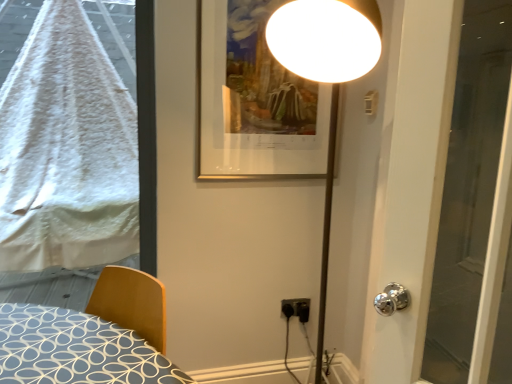
Question: Should I look upward or downward to see gold metallic picture frame at upper center?

Choices:
 (A) down
 (B) up

Answer: (B)

Question: Is transparent glass door at right thinner than black plastic electric outlet at lower center?

Choices:
 (A) no
 (B) yes

Answer: (A)

Question: Can you confirm if transparent glass door at right is positioned to the right of black plastic electric outlet at lower center?

Choices:
 (A) no
 (B) yes

Answer: (B)

Question: From a real-world perspective, is transparent glass door at right physically below black plastic electric outlet at lower center?

Choices:
 (A) yes
 (B) no

Answer: (B)

Question: Is transparent glass door at right bigger than black plastic electric outlet at lower center?

Choices:
 (A) no
 (B) yes

Answer: (B)

Question: Would you consider transparent glass door at right to be distant from black plastic electric outlet at lower center?

Choices:
 (A) no
 (B) yes

Answer: (A)

Question: Is transparent glass door at right taller than black plastic electric outlet at lower center?

Choices:
 (A) no
 (B) yes

Answer: (B)

Question: Does gold metallic picture frame at upper center have a larger size compared to black plastic electric outlet at lower center?

Choices:
 (A) yes
 (B) no

Answer: (A)

Question: Does gold metallic picture frame at upper center have a greater width compared to black plastic electric outlet at lower center?

Choices:
 (A) yes
 (B) no

Answer: (A)

Question: From the image's perspective, does gold metallic picture frame at upper center appear higher than black plastic electric outlet at lower center?

Choices:
 (A) yes
 (B) no

Answer: (A)

Question: Is gold metallic picture frame at upper center in front of black plastic electric outlet at lower center?

Choices:
 (A) yes
 (B) no

Answer: (A)

Question: Is gold metallic picture frame at upper center with black plastic electric outlet at lower center?

Choices:
 (A) no
 (B) yes

Answer: (A)

Question: From a real-world perspective, is gold metallic picture frame at upper center positioned under black plastic electric outlet at lower center based on gravity?

Choices:
 (A) no
 (B) yes

Answer: (A)

Question: From a real-world perspective, is wooden bed at lower left over white fluffy blanket at left?

Choices:
 (A) no
 (B) yes

Answer: (A)